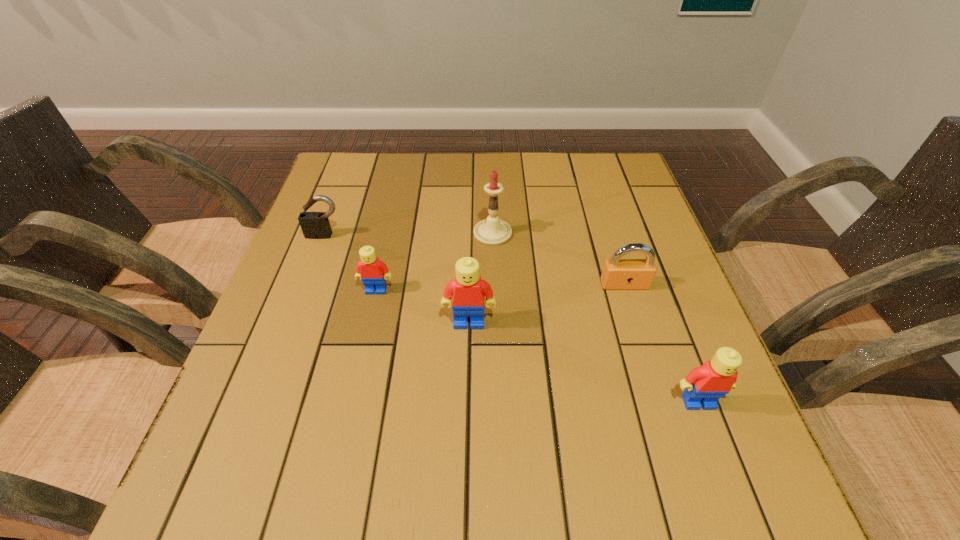
To make them evenly spaced by inserting another Lego among them, please locate a vacant spot for this new Lego. Please provide its 2D coordinates. Your answer should be formatted as a tuple, i.e. [(x, y)], where the tuple contains the x and y coordinates of a point satisfying the conditions above.

[(575, 359)]